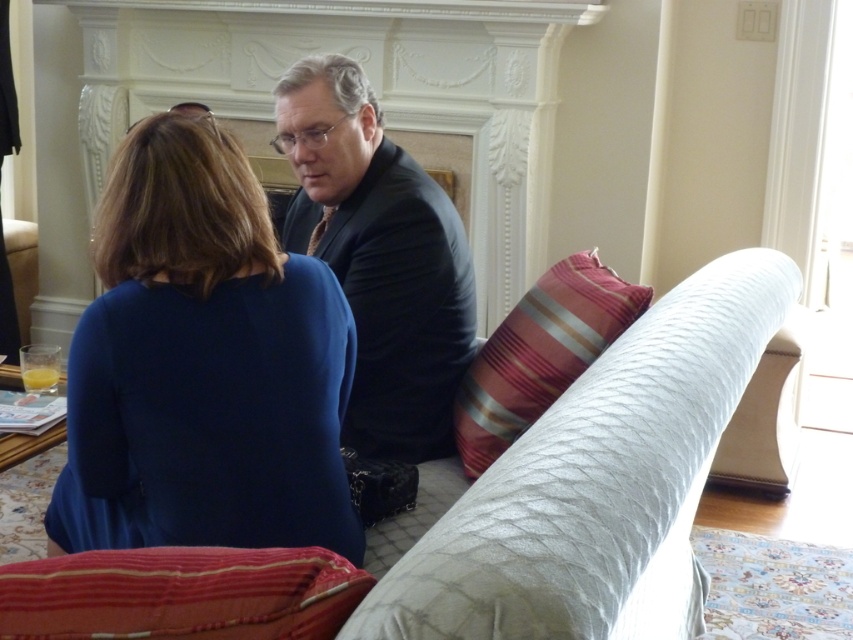
Which is in front, point (184, 237) or point (701, 600)?

Point (184, 237) is in front.

Who is positioned more to the right, navy blue fabric dress at center or white quilted couch at center?

From the viewer's perspective, white quilted couch at center appears more on the right side.

This screenshot has width=853, height=640. Describe the element at coordinates (202, 365) in the screenshot. I see `navy blue fabric dress at center` at that location.

Where is `navy blue fabric dress at center`? navy blue fabric dress at center is located at coordinates (202, 365).

From the picture: Who is more forward, [102,604] or [595,320]?

Point [102,604] is in front.

Who is positioned more to the left, red striped cushion at lower left or striped fabric pillow at center?

red striped cushion at lower left is more to the left.

Which is in front, point (148, 548) or point (489, 378)?

Point (148, 548) is more forward.

The image size is (853, 640). I want to click on red striped cushion at lower left, so click(x=180, y=595).

Is the position of white quilted couch at center more distant than that of striped fabric pillow at center?

No, white quilted couch at center is closer to the viewer.

Locate an element on the screen. white quilted couch at center is located at coordinates (595, 483).